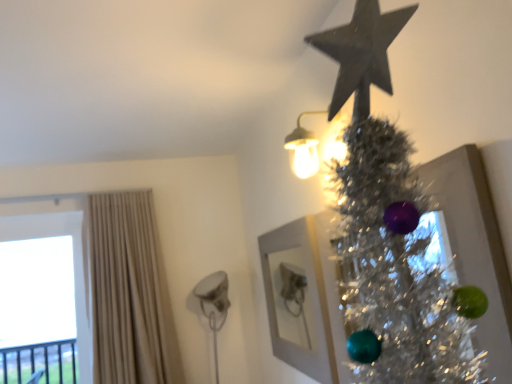
Question: Are matte white sconce at upper right and transparent glass window at left far apart?

Choices:
 (A) yes
 (B) no

Answer: (A)

Question: Is matte white sconce at upper right shorter than transparent glass window at left?

Choices:
 (A) no
 (B) yes

Answer: (B)

Question: Can you confirm if matte white sconce at upper right is smaller than transparent glass window at left?

Choices:
 (A) yes
 (B) no

Answer: (A)

Question: Could you tell me if matte white sconce at upper right is turned towards transparent glass window at left?

Choices:
 (A) no
 (B) yes

Answer: (A)

Question: Can you confirm if matte white sconce at upper right is wider than transparent glass window at left?

Choices:
 (A) no
 (B) yes

Answer: (B)

Question: Are matte white sconce at upper right and transparent glass window at left making contact?

Choices:
 (A) yes
 (B) no

Answer: (B)

Question: Is shiny silver tinsel at upper right completely or partially outside of matte white sconce at upper right?

Choices:
 (A) no
 (B) yes

Answer: (B)

Question: From the image's perspective, is shiny silver tinsel at upper right on top of matte white sconce at upper right?

Choices:
 (A) no
 (B) yes

Answer: (A)

Question: Can you see shiny silver tinsel at upper right touching matte white sconce at upper right?

Choices:
 (A) no
 (B) yes

Answer: (A)

Question: Is shiny silver tinsel at upper right far away from matte white sconce at upper right?

Choices:
 (A) no
 (B) yes

Answer: (A)

Question: Is matte white sconce at upper right located within shiny silver tinsel at upper right?

Choices:
 (A) no
 (B) yes

Answer: (A)

Question: Does shiny silver tinsel at upper right lie behind matte white sconce at upper right?

Choices:
 (A) yes
 (B) no

Answer: (B)

Question: From a real-world perspective, is beige fabric curtain at left physically above shiny silver tinsel at upper right?

Choices:
 (A) no
 (B) yes

Answer: (B)